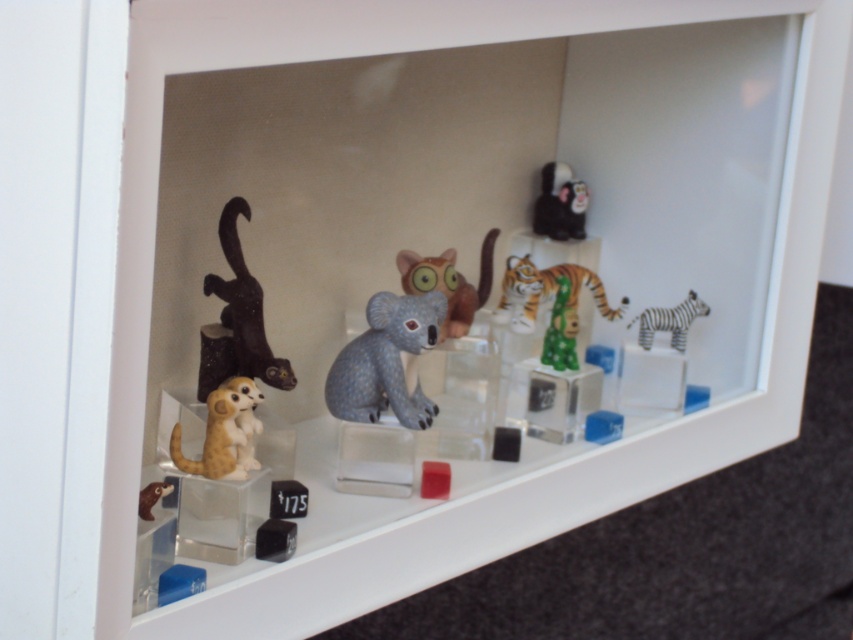
Looking at the display case with miniature animal figurines, where is the textured gray koala at center in relation to the light brown plush meerkat at lower left?

The textured gray koala at center is to the right of the light brown plush meerkat at lower left.

You are standing in front of the display case and want to touch the point at coordinates point (647, 348). If your hand can reach up to 1.3 meters, will you be able to reach it?

The point (647, 348) is 1.33 meters away from the camera, so your hand can reach up to 1.3 meters, meaning you cannot quite reach it.